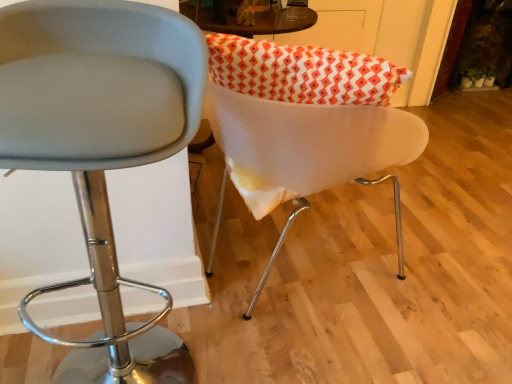
Where is `matte gray stool at center, which is counted as the 1th chair, starting from the left`? matte gray stool at center, which is counted as the 1th chair, starting from the left is located at coordinates (101, 149).

Describe the element at coordinates (101, 149) in the screenshot. The width and height of the screenshot is (512, 384). I see `matte gray stool at center, which is counted as the 1th chair, starting from the left` at that location.

What is the approximate width of white glossy chair at center, the second chair from the left?

18.50 inches.

The image size is (512, 384). What are the coordinates of `white glossy chair at center, which ranks as the first chair in right-to-left order` in the screenshot? It's located at [x=308, y=117].

What do you see at coordinates (308, 117) in the screenshot? I see `white glossy chair at center, which ranks as the first chair in right-to-left order` at bounding box center [308, 117].

What is the approximate height of white glossy chair at center, the second chair from the left?

white glossy chair at center, the second chair from the left, is 19.93 inches in height.

The image size is (512, 384). Identify the location of matte gray stool at center, the second chair from the right. (101, 149).

Which object is positioned more to the left, matte gray stool at center, which is counted as the 1th chair, starting from the left, or white glossy chair at center, which ranks as the first chair in right-to-left order?

matte gray stool at center, which is counted as the 1th chair, starting from the left, is more to the left.

Between matte gray stool at center, which is counted as the 1th chair, starting from the left, and white glossy chair at center, the second chair from the left, which one is positioned in front?

matte gray stool at center, which is counted as the 1th chair, starting from the left, is in front.

Is point (92, 366) closer or farther from the camera than point (223, 43)?

Point (92, 366) appears to be farther away from the viewer than point (223, 43).

From the image's perspective, does matte gray stool at center, the second chair from the right, appear lower than white glossy chair at center, which ranks as the first chair in right-to-left order?

Indeed, from the image's perspective, matte gray stool at center, the second chair from the right, is shown beneath white glossy chair at center, which ranks as the first chair in right-to-left order.

From a real-world perspective, is matte gray stool at center, which is counted as the 1th chair, starting from the left, on white glossy chair at center, the second chair from the left?

No, from a real-world perspective, matte gray stool at center, which is counted as the 1th chair, starting from the left, is not over white glossy chair at center, the second chair from the left

Can you confirm if matte gray stool at center, the second chair from the right, is wider than white glossy chair at center, the second chair from the left?

Incorrect, the width of matte gray stool at center, the second chair from the right, does not surpass that of white glossy chair at center, the second chair from the left.

Can you confirm if matte gray stool at center, which is counted as the 1th chair, starting from the left, is shorter than white glossy chair at center, the second chair from the left?

Incorrect, the height of matte gray stool at center, which is counted as the 1th chair, starting from the left, does not fall short of that of white glossy chair at center, the second chair from the left.

Between matte gray stool at center, the second chair from the right, and white glossy chair at center, the second chair from the left, which one has smaller size?

With smaller size is white glossy chair at center, the second chair from the left.

From the picture: Which is correct: matte gray stool at center, the second chair from the right, is inside white glossy chair at center, the second chair from the left, or outside of it?

matte gray stool at center, the second chair from the right, is located beyond the bounds of white glossy chair at center, the second chair from the left.

Is matte gray stool at center, which is counted as the 1th chair, starting from the left, not close to white glossy chair at center, which ranks as the first chair in right-to-left order?

No, matte gray stool at center, which is counted as the 1th chair, starting from the left, is not far from white glossy chair at center, which ranks as the first chair in right-to-left order.

Consider the image. Is matte gray stool at center, which is counted as the 1th chair, starting from the left, aimed at white glossy chair at center, which ranks as the first chair in right-to-left order?

No, matte gray stool at center, which is counted as the 1th chair, starting from the left, is not facing towards white glossy chair at center, which ranks as the first chair in right-to-left order.

I want to click on chair below the white glossy chair at center, the second chair from the left (from a real-world perspective), so click(101, 149).

Visually, is white glossy chair at center, which ranks as the first chair in right-to-left order, positioned to the left or to the right of matte gray stool at center, the second chair from the right?

From the image, it's evident that white glossy chair at center, which ranks as the first chair in right-to-left order, is to the right of matte gray stool at center, the second chair from the right.

Is white glossy chair at center, which ranks as the first chair in right-to-left order, in front of or behind matte gray stool at center, the second chair from the right, in the image?

In the image, white glossy chair at center, which ranks as the first chair in right-to-left order, appears behind matte gray stool at center, the second chair from the right.

Does point (397, 126) come in front of point (70, 341)?

Yes, point (397, 126) is closer to viewer.

From the image's perspective, is white glossy chair at center, which ranks as the first chair in right-to-left order, above matte gray stool at center, which is counted as the 1th chair, starting from the left?

Yes, from the image's perspective, white glossy chair at center, which ranks as the first chair in right-to-left order, is above matte gray stool at center, which is counted as the 1th chair, starting from the left.

From a real-world perspective, relative to matte gray stool at center, the second chair from the right, is white glossy chair at center, which ranks as the first chair in right-to-left order, vertically above or below?

From a real-world perspective, white glossy chair at center, which ranks as the first chair in right-to-left order, is physically above matte gray stool at center, the second chair from the right.

Considering the sizes of objects white glossy chair at center, which ranks as the first chair in right-to-left order, and matte gray stool at center, the second chair from the right, in the image provided, who is wider, white glossy chair at center, which ranks as the first chair in right-to-left order, or matte gray stool at center, the second chair from the right,?

white glossy chair at center, which ranks as the first chair in right-to-left order, is wider.

Considering the sizes of white glossy chair at center, the second chair from the left, and matte gray stool at center, which is counted as the 1th chair, starting from the left, in the image, is white glossy chair at center, the second chair from the left, taller or shorter than matte gray stool at center, which is counted as the 1th chair, starting from the left,?

white glossy chair at center, the second chair from the left, is shorter than matte gray stool at center, which is counted as the 1th chair, starting from the left.

Which of these two, white glossy chair at center, the second chair from the left, or matte gray stool at center, the second chair from the right, is smaller?

white glossy chair at center, the second chair from the left.

Is white glossy chair at center, the second chair from the left, not within matte gray stool at center, the second chair from the right?

white glossy chair at center, the second chair from the left, lies outside matte gray stool at center, the second chair from the right,'s area.

Are white glossy chair at center, the second chair from the left, and matte gray stool at center, the second chair from the right, far apart?

No, white glossy chair at center, the second chair from the left, is in close proximity to matte gray stool at center, the second chair from the right.

Is white glossy chair at center, the second chair from the left, positioned with its back to matte gray stool at center, the second chair from the right?

That's not correct — white glossy chair at center, the second chair from the left, is not looking away from matte gray stool at center, the second chair from the right.

Find the location of a particular element. chair above the matte gray stool at center, which is counted as the 1th chair, starting from the left (from a real-world perspective) is located at coordinates (308, 117).

Identify the location of chair below the white glossy chair at center, which ranks as the first chair in right-to-left order (from the image's perspective). (101, 149).

The width and height of the screenshot is (512, 384). I want to click on chair above the matte gray stool at center, which is counted as the 1th chair, starting from the left (from the image's perspective), so click(308, 117).